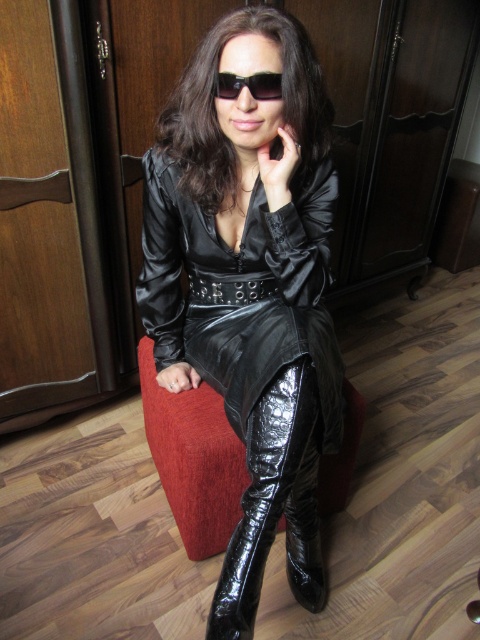
Question: From the image, what is the correct spatial relationship of glossy black leather jacket at center in relation to black glossy sunglasses at center?

Choices:
 (A) above
 (B) below

Answer: (B)

Question: From the image, what is the correct spatial relationship of glossy black leather jacket at center in relation to glossy patent leather boot at lower center?

Choices:
 (A) left
 (B) right

Answer: (A)

Question: Which point is farther to the camera?

Choices:
 (A) black glossy sunglasses at center
 (B) glossy patent leather boot at lower center
 (C) glossy black leather jacket at center

Answer: (C)

Question: Estimate the real-world distances between objects in this image. Which object is closer to the glossy black leather jacket at center?

Choices:
 (A) glossy patent leather boot at lower center
 (B) black glossy sunglasses at center

Answer: (A)

Question: Which point appears farthest from the camera in this image?

Choices:
 (A) (190, 209)
 (B) (241, 83)

Answer: (A)

Question: Is glossy leather dress at center below black glossy sunglasses at center?

Choices:
 (A) yes
 (B) no

Answer: (A)